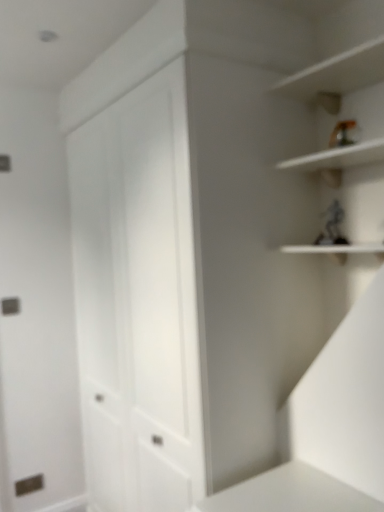
Measure the distance between white matte shelf at upper right and camera.

white matte shelf at upper right is 1.31 meters from camera.

What do you see at coordinates (337, 73) in the screenshot? The height and width of the screenshot is (512, 384). I see `white matte shelf at upper right` at bounding box center [337, 73].

You are a GUI agent. You are given a task and a screenshot of the screen. Output one action in this format:
    pyautogui.click(x=<x>, y=<y>)
    Task: Click on the white matte shelf at upper right
    This screenshot has height=512, width=384.
    Given the screenshot: What is the action you would take?
    pyautogui.click(x=337, y=73)

This screenshot has width=384, height=512. I want to click on white matte shelf at upper right, so click(x=337, y=73).